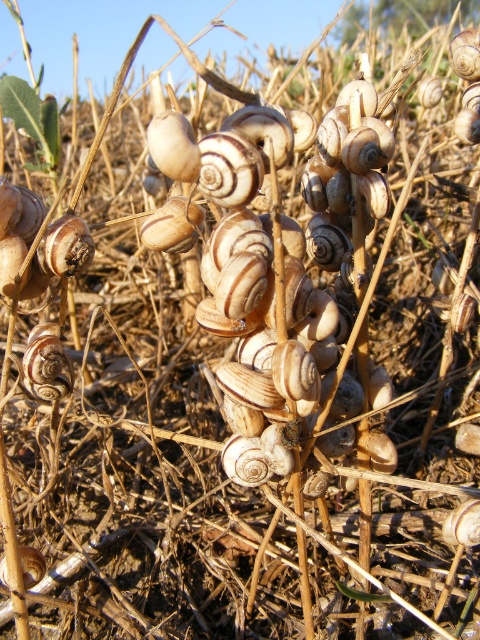
Question: Which object is farther from the camera taking this photo?

Choices:
 (A) matte white shell at center
 (B) matte beige shell at center

Answer: (A)

Question: Is matte beige shell at center thinner than matte white shell at center?

Choices:
 (A) yes
 (B) no

Answer: (B)

Question: Among these objects, which one is nearest to the camera?

Choices:
 (A) matte white shell at center
 (B) matte beige shell at center

Answer: (B)

Question: Can you confirm if matte beige shell at center is thinner than matte white shell at center?

Choices:
 (A) no
 (B) yes

Answer: (A)

Question: Is matte beige shell at center wider than matte white shell at center?

Choices:
 (A) yes
 (B) no

Answer: (A)